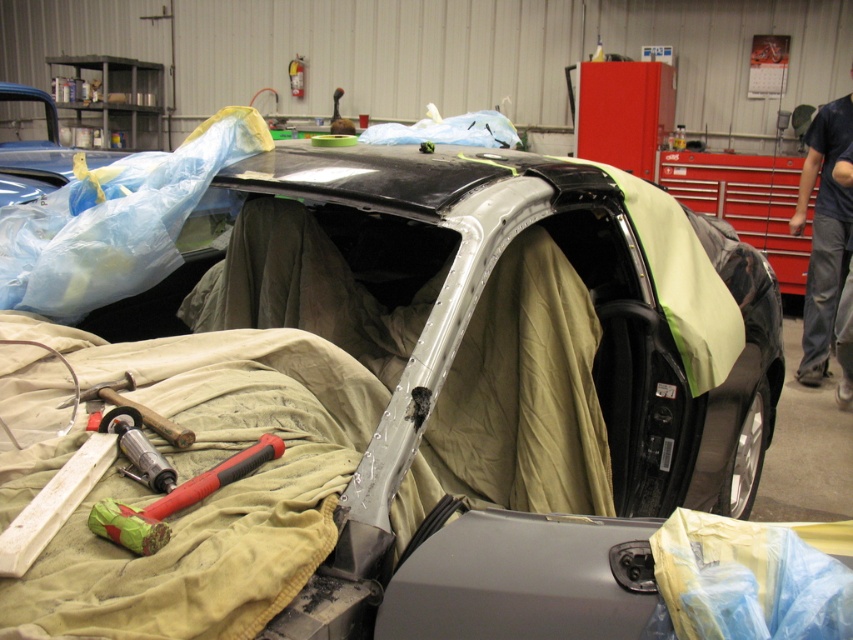
Question: Can you confirm if dark blue shirt at right is bigger than metallic silver drill bit at lower left?

Choices:
 (A) yes
 (B) no

Answer: (A)

Question: Among these points, which one is nearest to the camera?

Choices:
 (A) (134, 465)
 (B) (270, 442)
 (C) (195, 212)

Answer: (A)

Question: Considering the relative positions of dark blue shirt at right and red rubber hammer at lower left in the image provided, where is dark blue shirt at right located with respect to red rubber hammer at lower left?

Choices:
 (A) above
 (B) below

Answer: (A)

Question: Can you confirm if metallic silver car at center is positioned below dark blue shirt at right?

Choices:
 (A) no
 (B) yes

Answer: (B)

Question: Which object is closer to the camera taking this photo?

Choices:
 (A) red rubber hammer at lower left
 (B) dark blue shirt at right
 (C) metallic silver drill bit at lower left
 (D) metallic silver car at center

Answer: (A)

Question: Which point is farther to the camera?

Choices:
 (A) metallic silver car at center
 (B) metallic silver drill bit at lower left
 (C) dark blue shirt at right
 (D) red rubber hammer at lower left

Answer: (C)